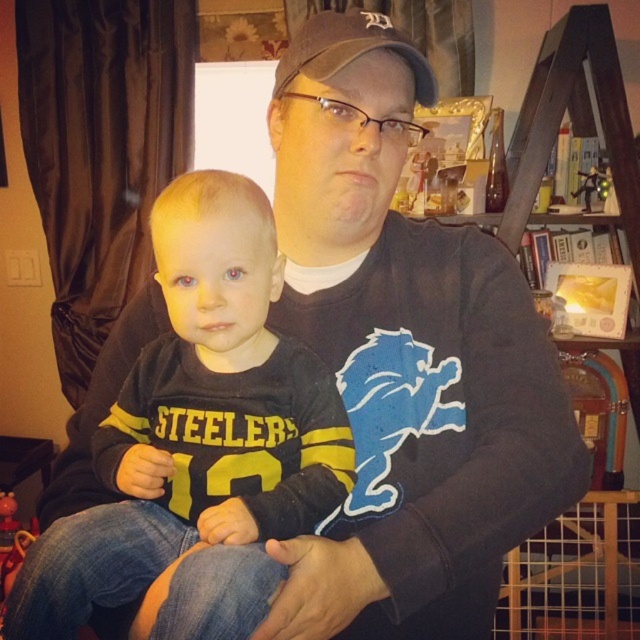
Can you confirm if black jersey at center is positioned below brown fabric baseball cap at upper center?

Yes, black jersey at center is below brown fabric baseball cap at upper center.

What do you see at coordinates (198, 440) in the screenshot? I see `black jersey at center` at bounding box center [198, 440].

You are a GUI agent. You are given a task and a screenshot of the screen. Output one action in this format:
    pyautogui.click(x=<x>, y=<y>)
    Task: Click on the black jersey at center
    
    Given the screenshot: What is the action you would take?
    198,440